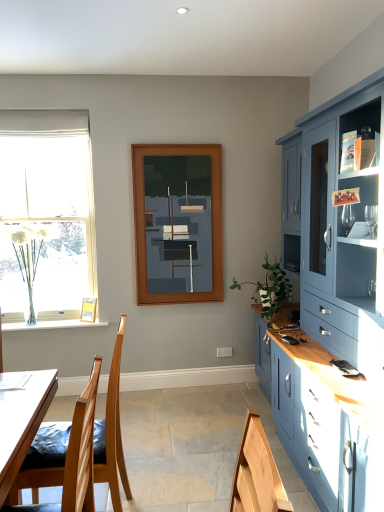
Question: Does wooden picture frame at lower left appear on the right side of matte wooden frame at center?

Choices:
 (A) yes
 (B) no

Answer: (B)

Question: Are wooden picture frame at lower left and matte wooden frame at center located far from each other?

Choices:
 (A) yes
 (B) no

Answer: (A)

Question: From the image's perspective, is wooden picture frame at lower left below matte wooden frame at center?

Choices:
 (A) yes
 (B) no

Answer: (A)

Question: Is wooden picture frame at lower left outside of matte wooden frame at center?

Choices:
 (A) yes
 (B) no

Answer: (A)

Question: Is the depth of wooden picture frame at lower left less than that of matte wooden frame at center?

Choices:
 (A) yes
 (B) no

Answer: (B)

Question: Would you say matte wooden frame at center is part of wooden picture frame at lower left's contents?

Choices:
 (A) no
 (B) yes

Answer: (A)

Question: Considering the relative sizes of clear glass vase at left and clear glass vase at left in the image provided, is clear glass vase at left smaller than clear glass vase at left?

Choices:
 (A) yes
 (B) no

Answer: (A)

Question: Is clear glass vase at left outside of clear glass vase at left?

Choices:
 (A) yes
 (B) no

Answer: (A)

Question: Is clear glass vase at left positioned behind clear glass vase at left?

Choices:
 (A) no
 (B) yes

Answer: (A)

Question: Is clear glass vase at left positioned in front of clear glass vase at left?

Choices:
 (A) yes
 (B) no

Answer: (A)

Question: Could you tell me if clear glass vase at left is turned towards clear glass vase at left?

Choices:
 (A) no
 (B) yes

Answer: (A)

Question: From the image's perspective, is clear glass vase at left located above clear glass vase at left?

Choices:
 (A) no
 (B) yes

Answer: (A)

Question: Is wooden chair at lower left closer to the viewer compared to clear glass vase at left?

Choices:
 (A) no
 (B) yes

Answer: (B)